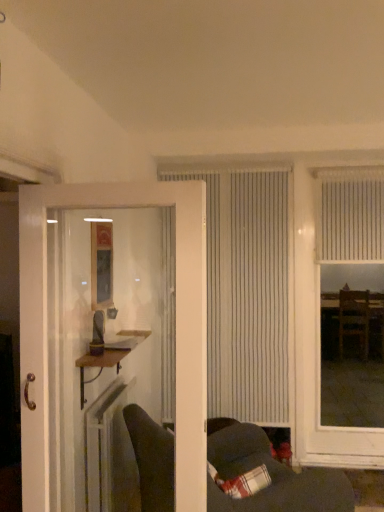
Question: From a real-world perspective, is white vertical blinds at right, placed as the second window when sorted from left to right, positioned above or below wooden shelf at left?

Choices:
 (A) below
 (B) above

Answer: (B)

Question: Would you say white vertical blinds at right, placed as the second window when sorted from left to right, is inside or outside wooden shelf at left?

Choices:
 (A) outside
 (B) inside

Answer: (A)

Question: Which object is the farthest from the white textured blind at upper right?

Choices:
 (A) white vertical blinds at right, placed as the second window when sorted from left to right
 (B) white wooden door at left
 (C) wooden shelf at left
 (D) white vertical blinds at center, the second window viewed from the right
 (E) dark gray fabric couch at lower center

Answer: (B)

Question: Estimate the real-world distances between objects in this image. Which object is closer to the white vertical blinds at right, placed as the second window when sorted from left to right?

Choices:
 (A) white textured blind at upper right
 (B) dark gray fabric couch at lower center
 (C) white plastic radiator at lower left
 (D) white vertical blinds at center, the 1th window viewed from the left
 (E) plaid fabric pillow at lower right

Answer: (D)